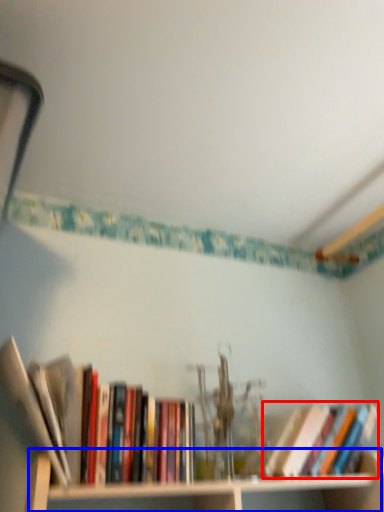
Question: Among these objects, which one is nearest to the camera, book (highlighted by a red box) or cabinet (highlighted by a blue box)?

Choices:
 (A) book
 (B) cabinet

Answer: (B)